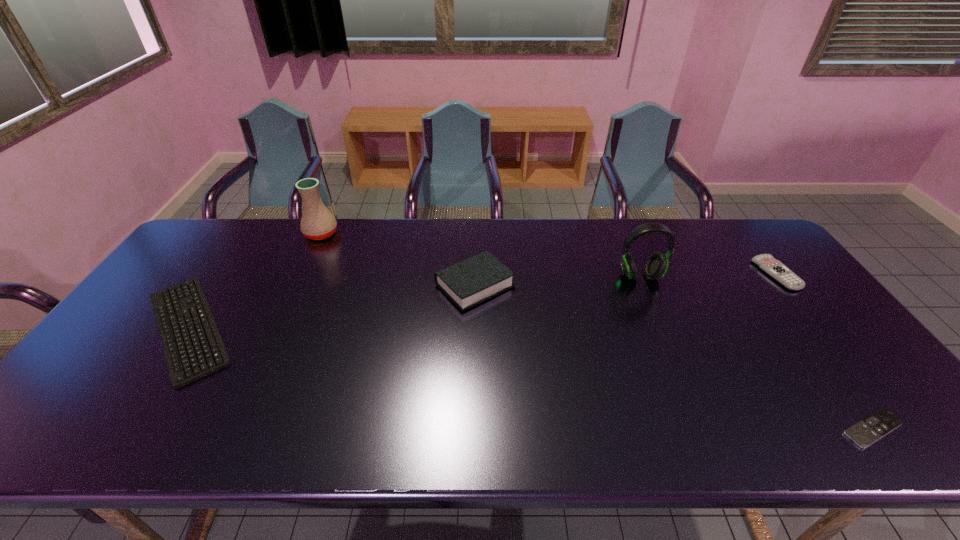
Image resolution: width=960 pixels, height=540 pixels. Find the location of `vacant region between the shorter remote control and the computer keyboard`. vacant region between the shorter remote control and the computer keyboard is located at coordinates (531, 378).

Locate an element on the screen. Image resolution: width=960 pixels, height=540 pixels. blank region between the pottery and the third object from left to right is located at coordinates (398, 260).

Find the location of a particular element. This screenshot has height=540, width=960. empty space that is in between the fourth object from left to right and the Bible is located at coordinates (558, 281).

What are the coordinates of `object that is the closest to the nearest object` in the screenshot? It's located at (766, 262).

Identify the location of the fifth closest object relative to the third object from left to right. (766, 262).